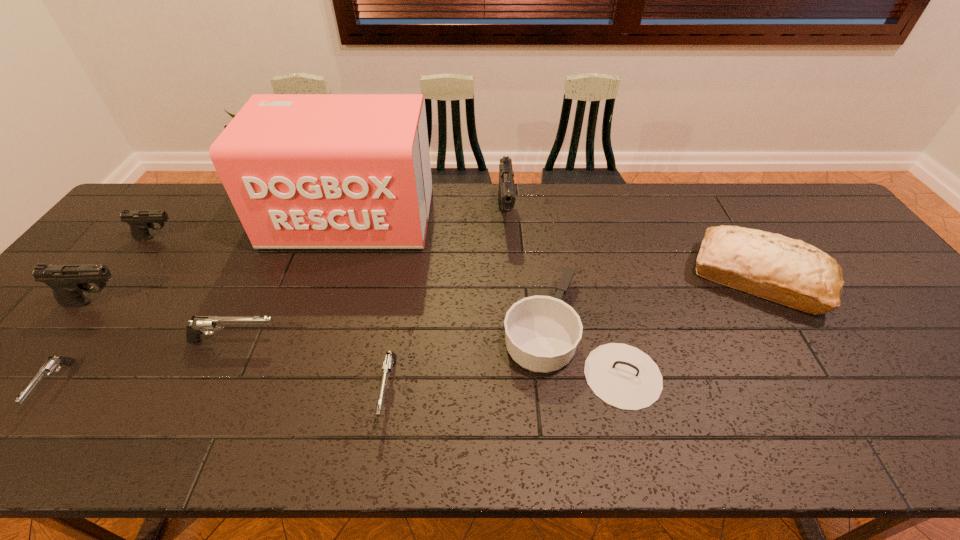
The image size is (960, 540). What are the coordinates of `vacant space at the far left corner` in the screenshot? It's located at (147, 201).

This screenshot has height=540, width=960. I want to click on vacant space at the far right corner of the desktop, so click(807, 206).

Find the location of a particular element. blank region between the tallest pistol and the second smallest silver pistol is located at coordinates (447, 304).

In order to click on free space between the smallest black pistol and the rightmost silver pistol in this screenshot , I will do `click(274, 314)`.

You are a GUI agent. You are given a task and a screenshot of the screen. Output one action in this format:
    pyautogui.click(x=<x>, y=<y>)
    Task: Click on the unoccupied area between the pink box and the shortest object
    This screenshot has width=960, height=540.
    Given the screenshot: What is the action you would take?
    pyautogui.click(x=204, y=301)

Identify the location of vacant space that is in between the rightmost object and the second tallest object. (633, 247).

Where is `empty space between the rightmost black pistol and the rightmost object`? empty space between the rightmost black pistol and the rightmost object is located at coordinates (633, 247).

This screenshot has width=960, height=540. What are the coordinates of `vacant space that's between the rightmost silver pistol and the third nearest pistol` in the screenshot? It's located at (312, 366).

Image resolution: width=960 pixels, height=540 pixels. Identify the location of vacant space that's between the rightmost silver pistol and the nearest black pistol. (243, 347).

Find the location of `vacant area that lies between the tallest pistol and the rightmost object`. vacant area that lies between the tallest pistol and the rightmost object is located at coordinates (633, 247).